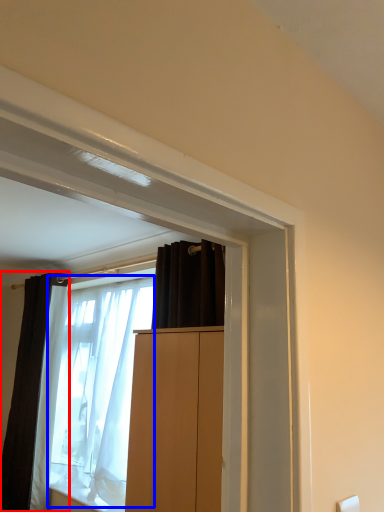
Question: Among these objects, which one is farthest to the camera, curtain (highlighted by a red box) or shower curtain (highlighted by a blue box)?

Choices:
 (A) curtain
 (B) shower curtain

Answer: (A)